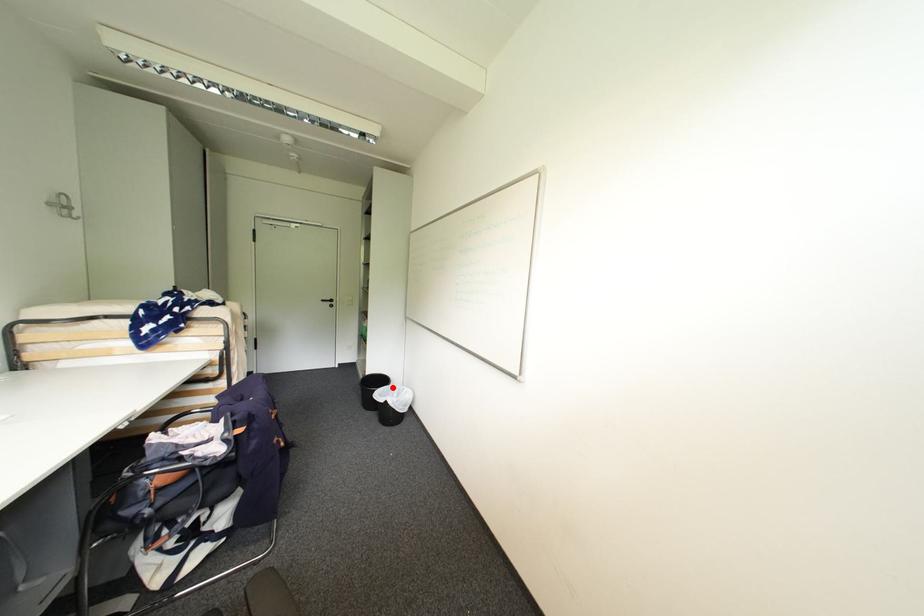
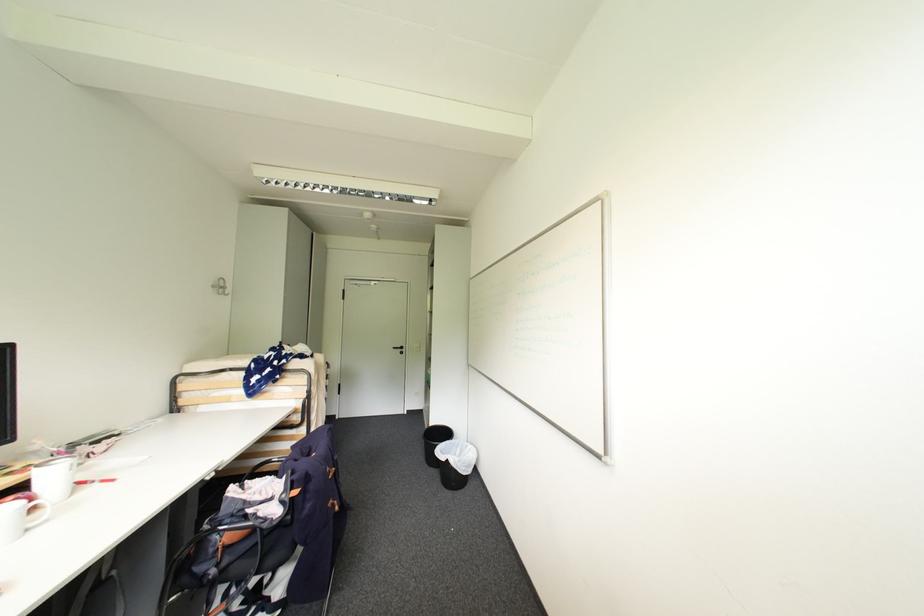
Find the pixel in the second image that matches the highlighted location in the first image.

(456, 442)